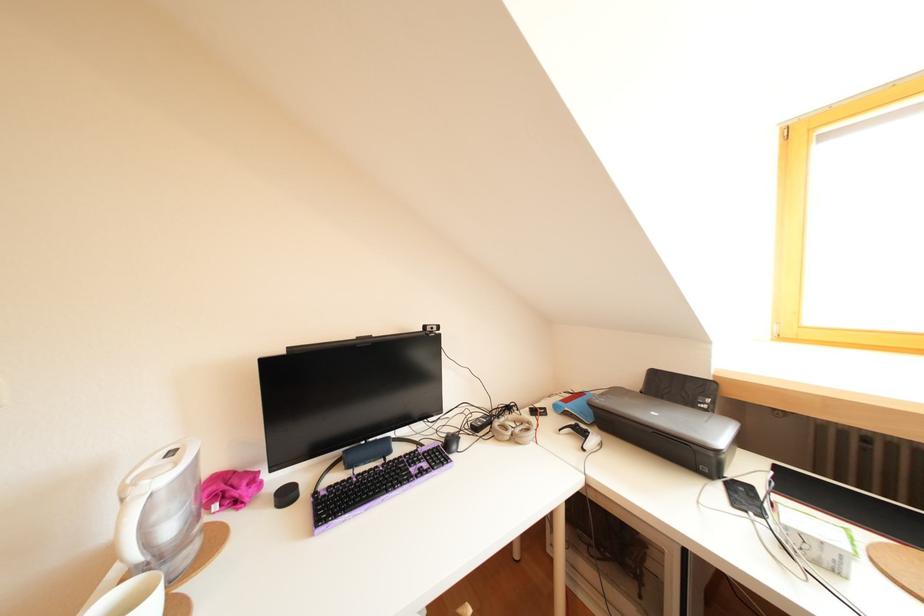
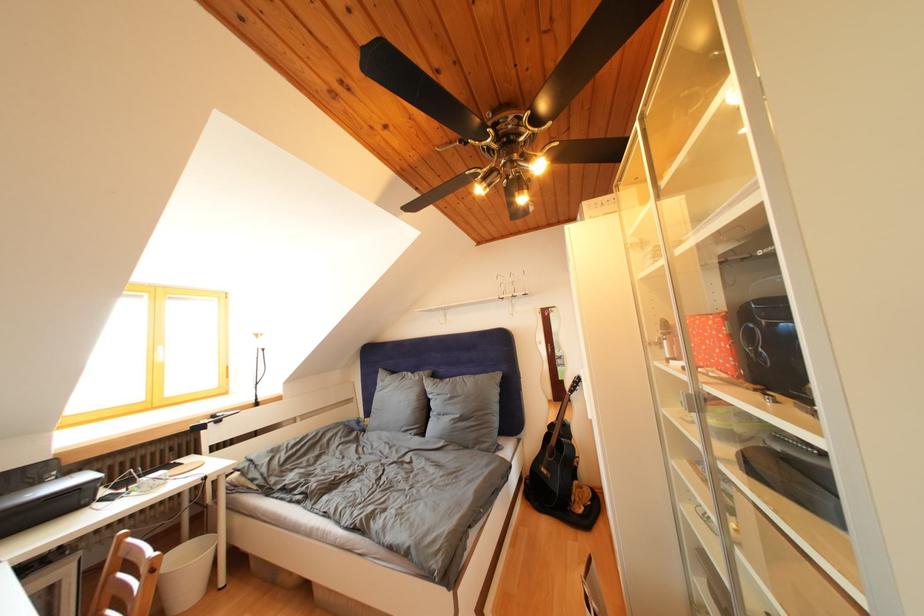
Find the pixel in the second image that matches point (699, 407) in the first image.

(44, 488)